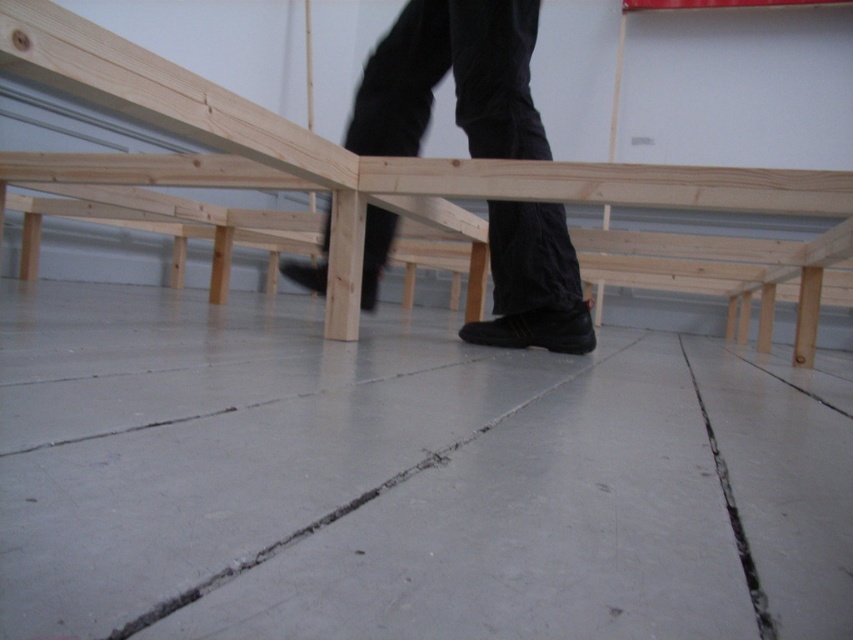
You are standing in a room and want to place a small nightstand. The natural wood bunk bed at center is located at point (370,157). Where should you place the nightstand so it is to the immediate left of the natural wood bunk bed at center?

The nightstand should be placed to the immediate left of the natural wood bunk bed at center at point (370,157).

You are a drone operator trying to capture a close shot of the wooden structure in the image. You notice two points marked as point 1 at coordinates point (444, 168) and point 2 at coordinates point (527, 93). Which point should you focus on to ensure it appears larger in your camera view?

Point 1 at coordinates point (444, 168) is closer to the camera, so focusing on it will make it appear larger in the camera view.

You are trying to navigate around the natural wood bunk bed at center in the image. Based on its position, can you estimate whether you would need to move to the left or right to avoid it?

The natural wood bunk bed at center is located at point (370,157), which is slightly to the left of the center point. Therefore, moving to the right would help avoid it.